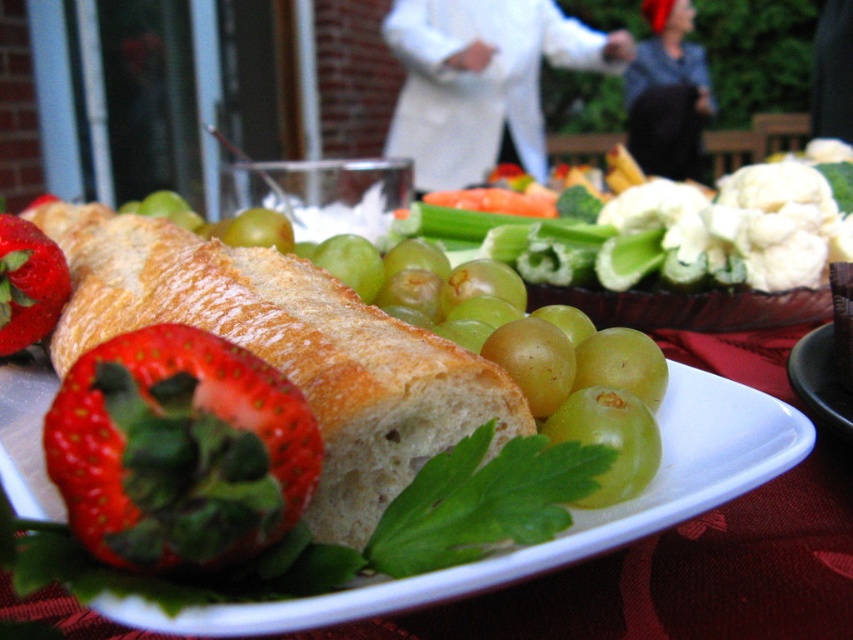
You are at a picnic and want to grab the red matte strawberry at lower left. However, there is a golden brown crusty bread at center blocking your view. Can you reach the strawberry without moving the bread?

The golden brown crusty bread at center is located above the red matte strawberry at lower left, so you can reach the strawberry by moving your hand under the bread or shifting your position to access it from the side.

You are looking at the image of the food spread. There are two points marked in the scene. Which point, point (126, 244) or point (560, 28), is closer to you?

Point (126, 244) is closer to the viewer than point (560, 28).

You are planning to pack snacks for a hike and have both the golden brown crusty bread at center and the shiny red strawberry at lower left. If you want to choose the bigger snack, which one should you pick?

The golden brown crusty bread at center has a larger size compared to the shiny red strawberry at lower left, so you should pick the golden brown crusty bread at center.